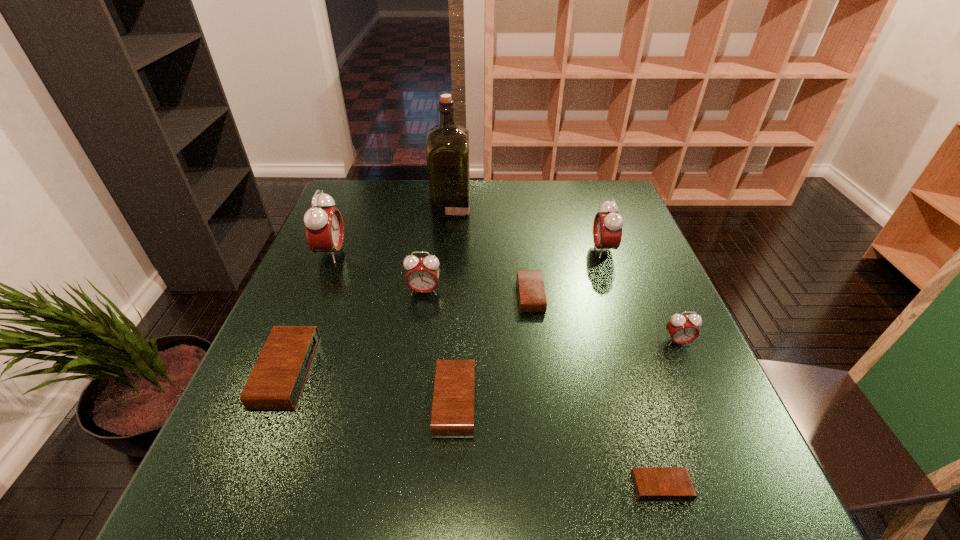
I want to click on pink alarm clock that is the second nearest to the second pink alarm clock from right to left, so pos(422,276).

Locate an element on the screen. This screenshot has height=540, width=960. pink alarm clock identified as the closest to the nearest object is located at coordinates (682, 329).

Identify which black alarm clock is located as the nearest to the second shortest alarm clock. Please provide its 2D coordinates. Your answer should be formatted as a tuple, i.e. [(x, y)], where the tuple contains the x and y coordinates of a point satisfying the conditions above.

[(452, 415)]

Locate an element on the screen. The height and width of the screenshot is (540, 960). black alarm clock that is the closest to the nearest pink alarm clock is located at coordinates (532, 298).

Locate an element on the screen. blank space that satisfies the following two spatial constraints: 1. on the label of the farthest object; 2. on the clock face of the third tallest alarm clock is located at coordinates click(x=444, y=291).

This screenshot has height=540, width=960. I want to click on free space that satisfies the following two spatial constraints: 1. on the clock face of the rightmost object; 2. on the front face of the third shortest alarm clock, so click(705, 402).